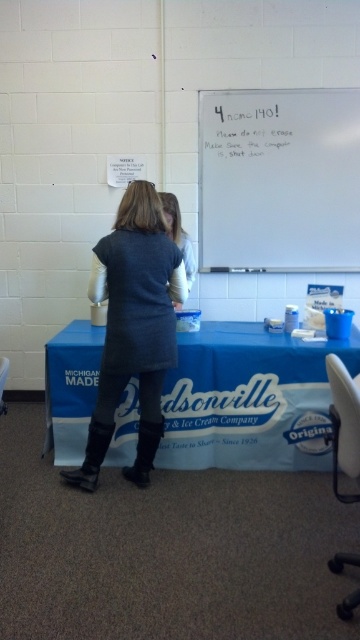
What is the 2D coordinate of the blue fabric table at center?

The 2D coordinate of the blue fabric table at center is at point (x=249, y=400).